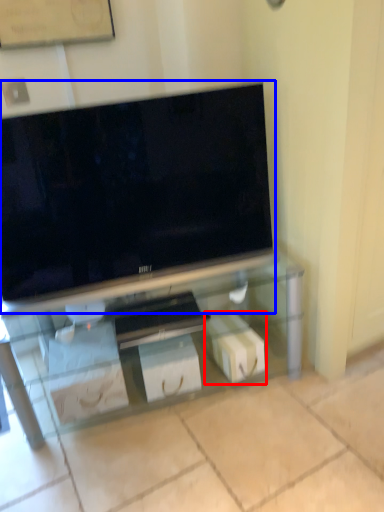
Question: Among these objects, which one is nearest to the camera, box (highlighted by a red box) or television (highlighted by a blue box)?

Choices:
 (A) box
 (B) television

Answer: (B)